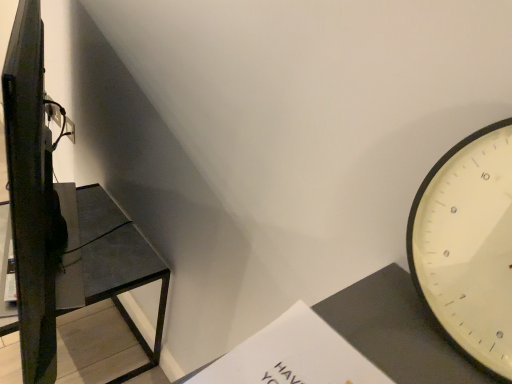
Describe the element at coordinates (293, 356) in the screenshot. I see `white paper at lower center` at that location.

What are the coordinates of `white paper at lower center` in the screenshot? It's located at (293, 356).

I want to click on matte black shelf at left, so click(x=116, y=255).

Looking at this image, in order to face matte black shelf at left, should I rotate leftwards or rightwards?

Turn left approximately 24.340 degrees to face it.

The width and height of the screenshot is (512, 384). What do you see at coordinates (116, 255) in the screenshot? I see `matte black shelf at left` at bounding box center [116, 255].

You are a GUI agent. You are given a task and a screenshot of the screen. Output one action in this format:
    pyautogui.click(x=<x>, y=<y>)
    Task: Click on the white paper at lower center
    
    Given the screenshot: What is the action you would take?
    pyautogui.click(x=293, y=356)

Between matte black shelf at left and white paper at lower center, which one appears on the right side from the viewer's perspective?

From the viewer's perspective, white paper at lower center appears more on the right side.

Is matte black shelf at left in front of or behind white paper at lower center in the image?

Clearly, matte black shelf at left is behind white paper at lower center.

Does point (96, 270) lie behind point (255, 366)?

Yes, point (96, 270) is behind point (255, 366).

From the image's perspective, is matte black shelf at left located beneath white paper at lower center?

Correct, matte black shelf at left appears lower than white paper at lower center in the image.

From a real-world perspective, is matte black shelf at left positioned above or below white paper at lower center?

From a real-world perspective, matte black shelf at left is physically below white paper at lower center.

Considering the relative sizes of matte black shelf at left and white paper at lower center in the image provided, is matte black shelf at left wider than white paper at lower center?

Indeed, matte black shelf at left has a greater width compared to white paper at lower center.

Who is shorter, matte black shelf at left or white paper at lower center?

With less height is white paper at lower center.

Based on the photo, considering the relative sizes of matte black shelf at left and white paper at lower center in the image provided, is matte black shelf at left smaller than white paper at lower center?

Incorrect, matte black shelf at left is not smaller in size than white paper at lower center.

Is matte black shelf at left inside or outside of white paper at lower center?

The correct answer is: outside.

Is matte black shelf at left beside white paper at lower center?

No, matte black shelf at left is not with white paper at lower center.

Is matte black shelf at left looking in the opposite direction of white paper at lower center?

No, matte black shelf at left is not facing away from white paper at lower center.

How many degrees apart are the facing directions of matte black shelf at left and white paper at lower center?

They differ by 0.276 degrees in their facing directions.

Measure the distance between matte black shelf at left and white paper at lower center.

matte black shelf at left and white paper at lower center are 34.24 inches apart from each other.

This screenshot has height=384, width=512. Identify the location of furniture behind the white paper at lower center. pyautogui.click(x=116, y=255).

Which is more to the right, white paper at lower center or matte black shelf at left?

white paper at lower center.

Based on the photo, does white paper at lower center lie behind matte black shelf at left?

No, white paper at lower center is closer to the viewer.

Does point (249, 350) come closer to viewer compared to point (138, 277)?

Yes, it is in front of point (138, 277).

From the image's perspective, between white paper at lower center and matte black shelf at left, which one is located above?

white paper at lower center.

From a real-world perspective, which is physically above, white paper at lower center or matte black shelf at left?

Result: white paper at lower center.

Looking at their sizes, would you say white paper at lower center is wider or thinner than matte black shelf at left?

white paper at lower center is thinner than matte black shelf at left.

Who is taller, white paper at lower center or matte black shelf at left?

Standing taller between the two is matte black shelf at left.

Considering the sizes of objects white paper at lower center and matte black shelf at left in the image provided, who is bigger, white paper at lower center or matte black shelf at left?

Bigger between the two is matte black shelf at left.

Is matte black shelf at left a part of white paper at lower center?

No, white paper at lower center does not contain matte black shelf at left.

Is white paper at lower center next to matte black shelf at left and touching it?

white paper at lower center and matte black shelf at left are not in contact.

Is white paper at lower center oriented towards matte black shelf at left?

No, white paper at lower center does not turn towards matte black shelf at left.

The image size is (512, 384). I want to click on paperback book that appears above the matte black shelf at left (from the image's perspective), so click(293, 356).

Where is `furniture beneath the white paper at lower center (from a real-world perspective)`? furniture beneath the white paper at lower center (from a real-world perspective) is located at coordinates (116, 255).

This screenshot has height=384, width=512. What are the coordinates of `paperback book that appears above the matte black shelf at left (from the image's perspective)` in the screenshot? It's located at (293, 356).